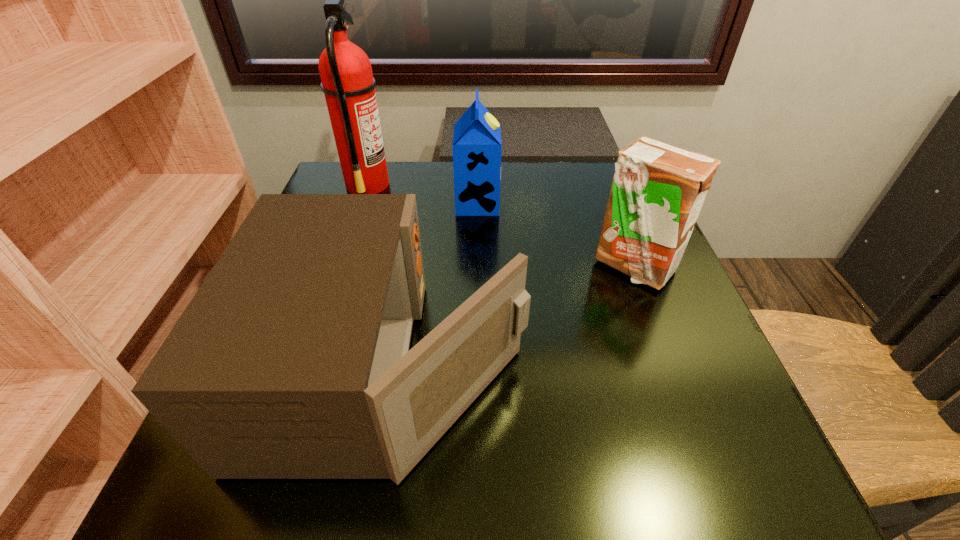
The image size is (960, 540). In order to click on carton located in the far edge section of the desktop in this screenshot , I will do `click(477, 146)`.

Locate an element on the screen. The height and width of the screenshot is (540, 960). object that is positioned at the near edge is located at coordinates (292, 361).

At what (x,y) coordinates should I click in order to perform the action: click on fire extinguisher that is at the left edge. Please return your answer as a coordinate pair (x, y). The image size is (960, 540). Looking at the image, I should click on (347, 82).

In order to click on microwave oven present at the left edge in this screenshot , I will do 292,361.

What are the coordinates of `object positioned at the right edge` in the screenshot? It's located at (658, 190).

Locate an element on the screen. object positioned at the far left corner is located at coordinates (347, 82).

Where is `object located in the near left corner section of the desktop`? Image resolution: width=960 pixels, height=540 pixels. object located in the near left corner section of the desktop is located at coordinates (292, 361).

What are the coordinates of `vacant space at the far edge` in the screenshot? It's located at (432, 206).

In the image, there is a desktop. Find the location of `vacant space at the right edge`. vacant space at the right edge is located at coordinates (689, 425).

Identify the location of free space at the near left corner of the desktop. This screenshot has height=540, width=960. (190, 478).